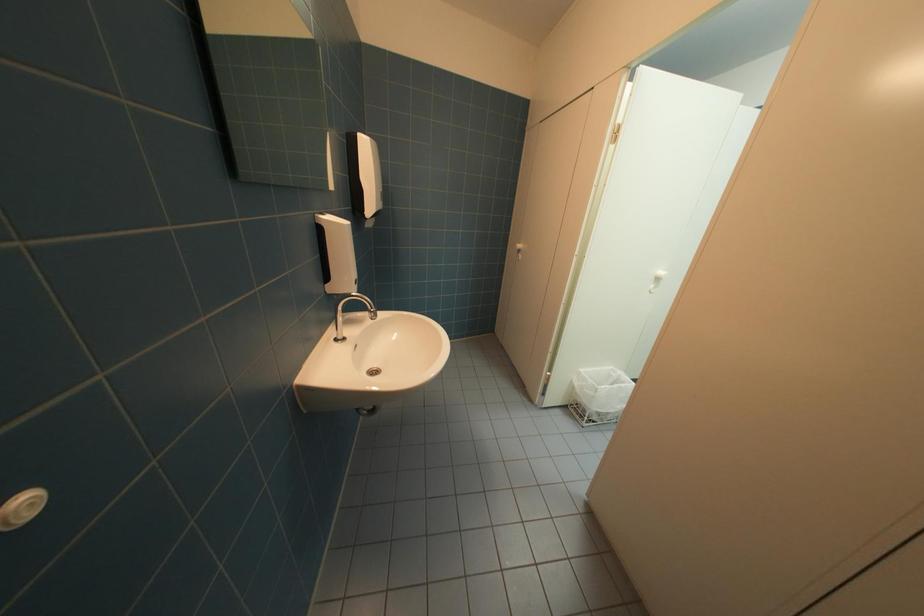
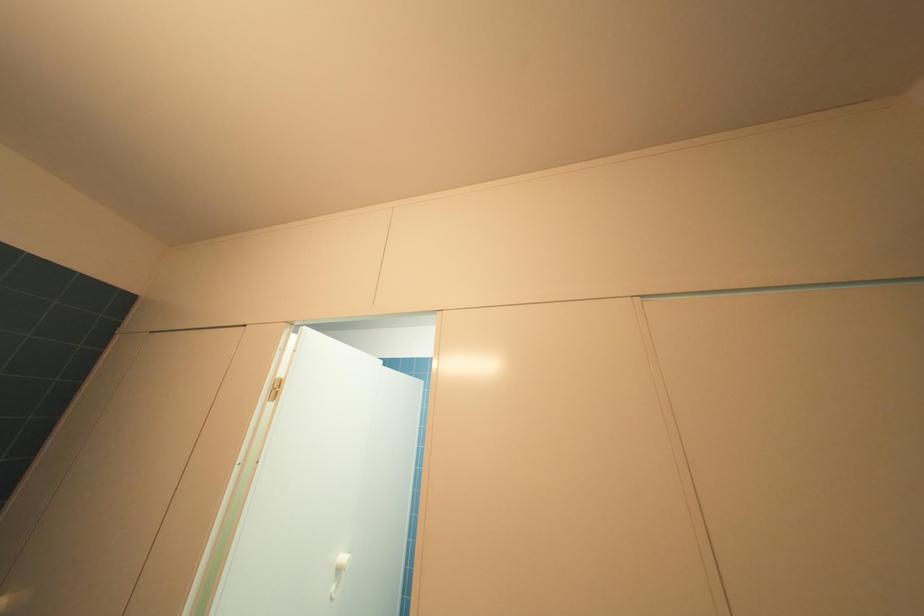
How did the camera likely rotate?

The camera rotated toward right-up.